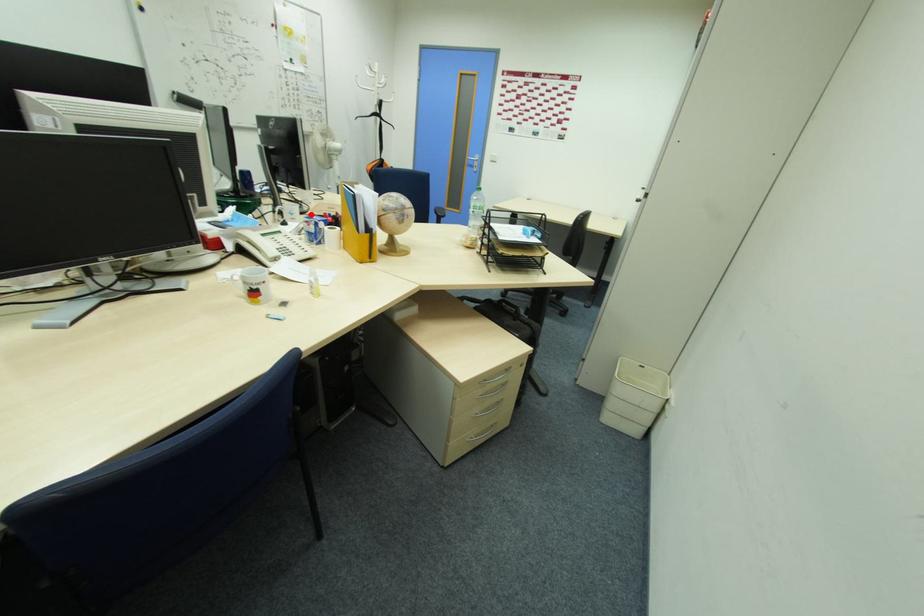
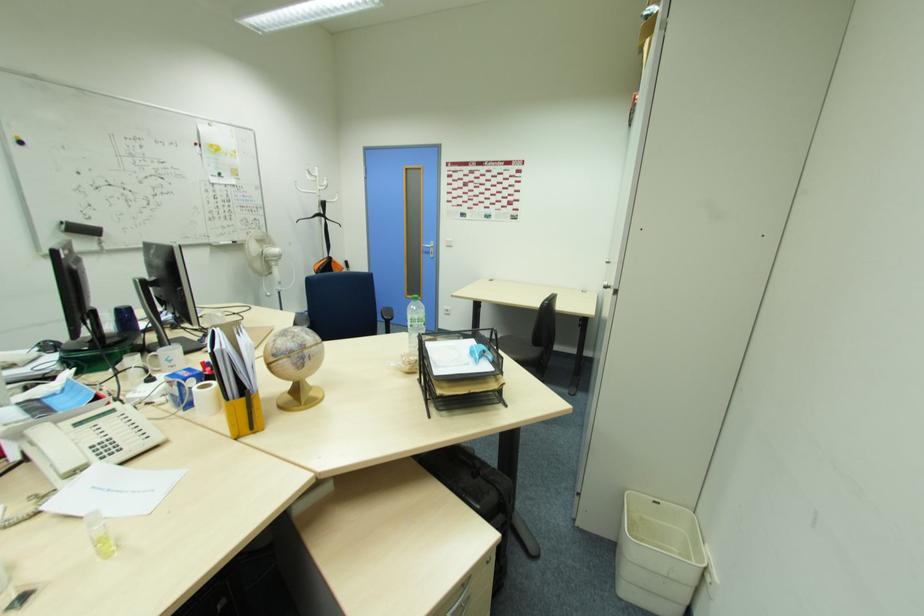
Find the pixel in the second image that matches the highlighted location in the first image.

(209, 351)